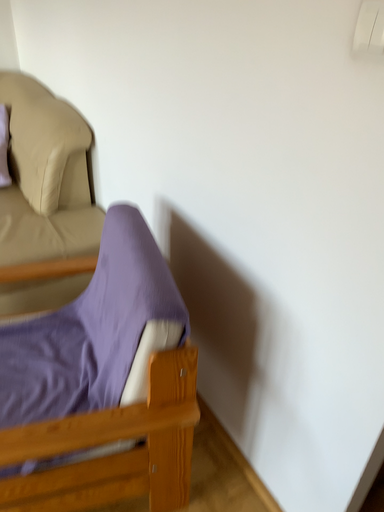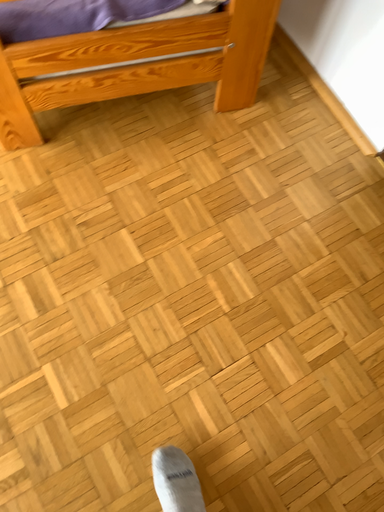
Question: Which way did the camera rotate in the video?

Choices:
 (A) rotated downward
 (B) rotated upward

Answer: (A)